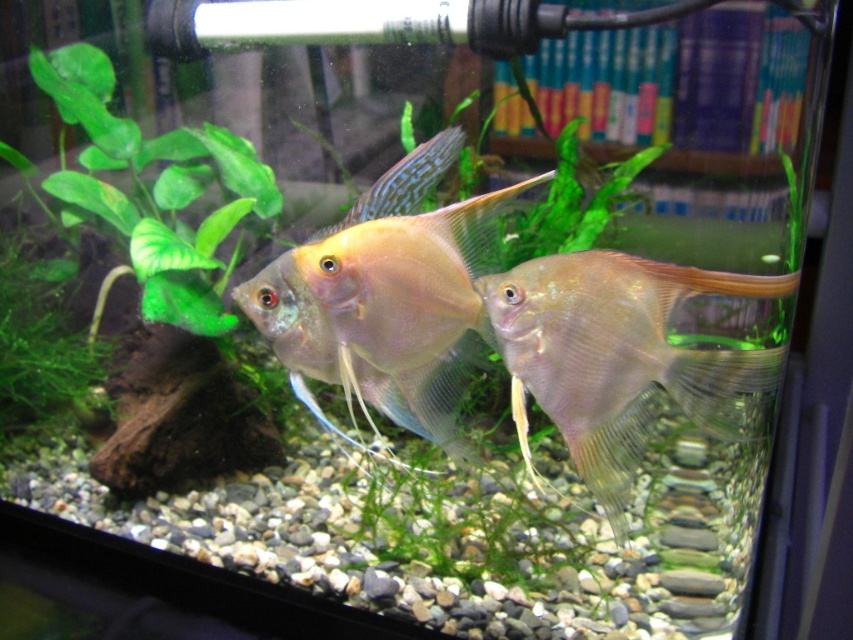
Does point (341, 305) come closer to viewer compared to point (236, 189)?

Yes, point (341, 305) is in front of point (236, 189).

Is point (291, 284) positioned after point (231, 141)?

No.

Find the location of a particular element. Image resolution: width=853 pixels, height=640 pixels. translucent glass fish at center is located at coordinates (383, 296).

Consider the image. Does translucent flesh-colored fish at center lie in front of translucent glass fish at center?

That is True.

Is translucent flesh-colored fish at center above translucent glass fish at center?

Incorrect, translucent flesh-colored fish at center is not positioned above translucent glass fish at center.

Which is in front, point (561, 394) or point (445, 225)?

Point (561, 394) is more forward.

Image resolution: width=853 pixels, height=640 pixels. I want to click on translucent flesh-colored fish at center, so click(624, 358).

Measure the distance between translucent flesh-colored fish at center and green leafy plant at left.

translucent flesh-colored fish at center and green leafy plant at left are 1.04 meters apart from each other.

What do you see at coordinates (624, 358) in the screenshot? I see `translucent flesh-colored fish at center` at bounding box center [624, 358].

Is point (759, 292) positioned after point (222, 179)?

No, (759, 292) is in front of (222, 179).

Image resolution: width=853 pixels, height=640 pixels. Identify the location of translucent flesh-colored fish at center. (624, 358).